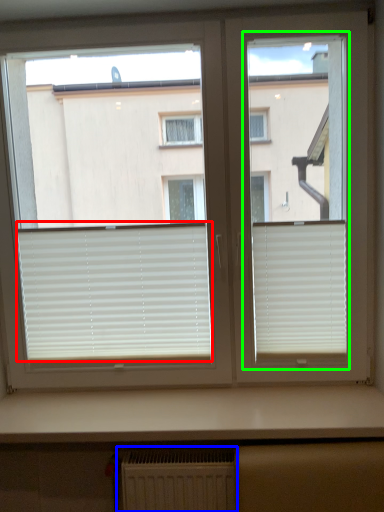
Question: Considering the real-world distances, which object is closest to window blind (highlighted by a red box)? radiator (highlighted by a blue box) or screen door (highlighted by a green box).

Choices:
 (A) radiator
 (B) screen door

Answer: (A)